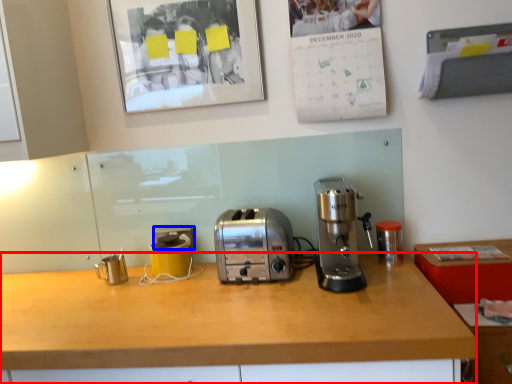
Question: Which object is closer to the camera taking this photo, desk (highlighted by a red box) or electric outlet (highlighted by a blue box)?

Choices:
 (A) desk
 (B) electric outlet

Answer: (A)